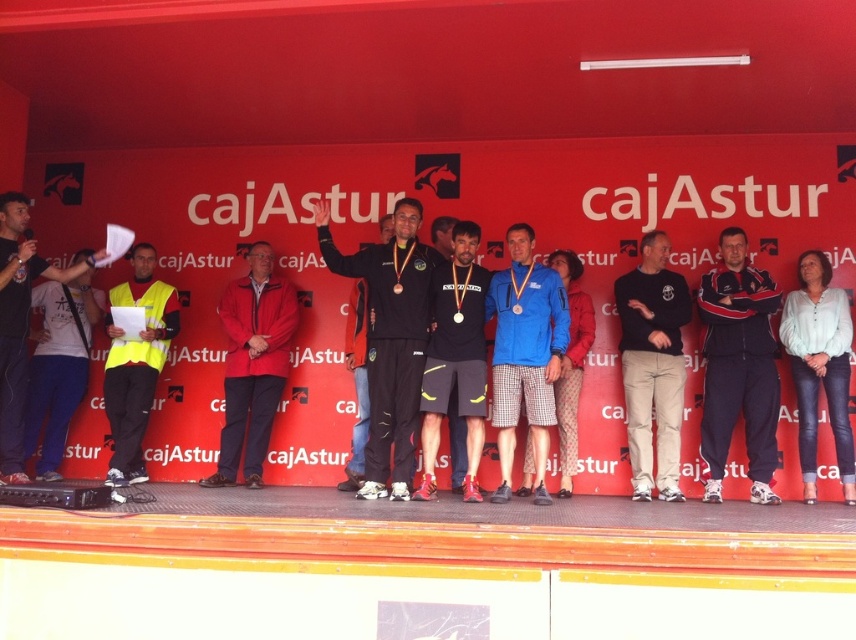
Question: In this image, where is matte black tracksuit at center located relative to red matte jacket at center?

Choices:
 (A) right
 (B) left

Answer: (A)

Question: Which of these objects is positioned closest to the matte gray shirt at left?

Choices:
 (A) yellow reflective vest at left
 (B) dark blue tracksuit at center
 (C) matte black tracksuit at center

Answer: (A)

Question: Does dark blue tracksuit at center come in front of black cotton pants at center?

Choices:
 (A) yes
 (B) no

Answer: (A)

Question: Which of the following is the farthest from the observer?

Choices:
 (A) matte gray shirt at left
 (B) yellow reflective vest at left
 (C) blue fabric shorts at center
 (D) black cotton pants at center

Answer: (B)

Question: Is matte black tracksuit at center smaller than dark blue tracksuit at center?

Choices:
 (A) yes
 (B) no

Answer: (B)

Question: Which point is farther to the camera?

Choices:
 (A) red matte jacket at center
 (B) matte black tracksuit at center
 (C) yellow reflective vest at left

Answer: (A)